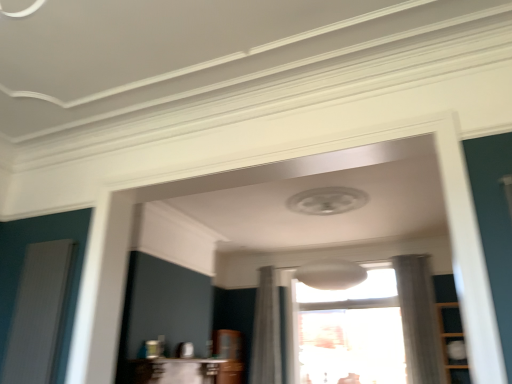
Question: Does wooden cabinet at right have a greater height compared to white ribbed screen door at left?

Choices:
 (A) no
 (B) yes

Answer: (B)

Question: Is wooden cabinet at right turned away from white ribbed screen door at left?

Choices:
 (A) no
 (B) yes

Answer: (A)

Question: Can you confirm if wooden cabinet at right is positioned to the left of white ribbed screen door at left?

Choices:
 (A) yes
 (B) no

Answer: (B)

Question: Is wooden cabinet at right bigger than white ribbed screen door at left?

Choices:
 (A) no
 (B) yes

Answer: (B)

Question: Is wooden cabinet at right facing towards white ribbed screen door at left?

Choices:
 (A) no
 (B) yes

Answer: (A)

Question: Does wooden cabinet at right have a lesser height compared to white ribbed screen door at left?

Choices:
 (A) yes
 (B) no

Answer: (B)

Question: Can you confirm if white sheer curtain at right, which is the first curtain in right-to-left order, is smaller than transparent glass window at center?

Choices:
 (A) yes
 (B) no

Answer: (A)

Question: Is white sheer curtain at right, arranged as the second curtain when viewed from the left, to the left of transparent glass window at center from the viewer's perspective?

Choices:
 (A) no
 (B) yes

Answer: (A)

Question: Does white sheer curtain at right, arranged as the second curtain when viewed from the left, lie in front of transparent glass window at center?

Choices:
 (A) no
 (B) yes

Answer: (B)

Question: Is white sheer curtain at right, which is the first curtain in right-to-left order, outside transparent glass window at center?

Choices:
 (A) yes
 (B) no

Answer: (A)

Question: Can you confirm if white sheer curtain at right, which is the first curtain in right-to-left order, is wider than transparent glass window at center?

Choices:
 (A) yes
 (B) no

Answer: (A)

Question: Considering the relative sizes of white sheer curtain at right, which is the first curtain in right-to-left order, and transparent glass window at center in the image provided, is white sheer curtain at right, which is the first curtain in right-to-left order, bigger than transparent glass window at center?

Choices:
 (A) yes
 (B) no

Answer: (B)

Question: Is white sheer curtain at right, arranged as the second curtain when viewed from the left, further to camera compared to white ribbed screen door at left?

Choices:
 (A) yes
 (B) no

Answer: (A)